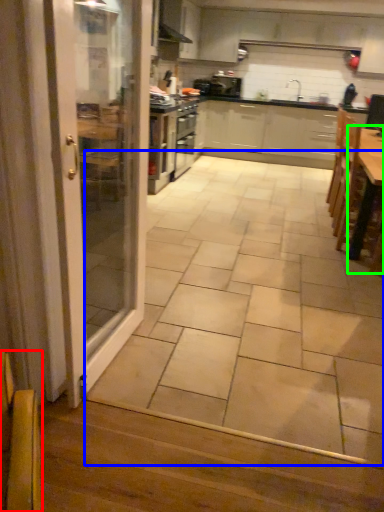
Question: Which is nearer to the armchair (highlighted by a red box)? ceramic tile (highlighted by a blue box) or table (highlighted by a green box).

Choices:
 (A) ceramic tile
 (B) table

Answer: (A)